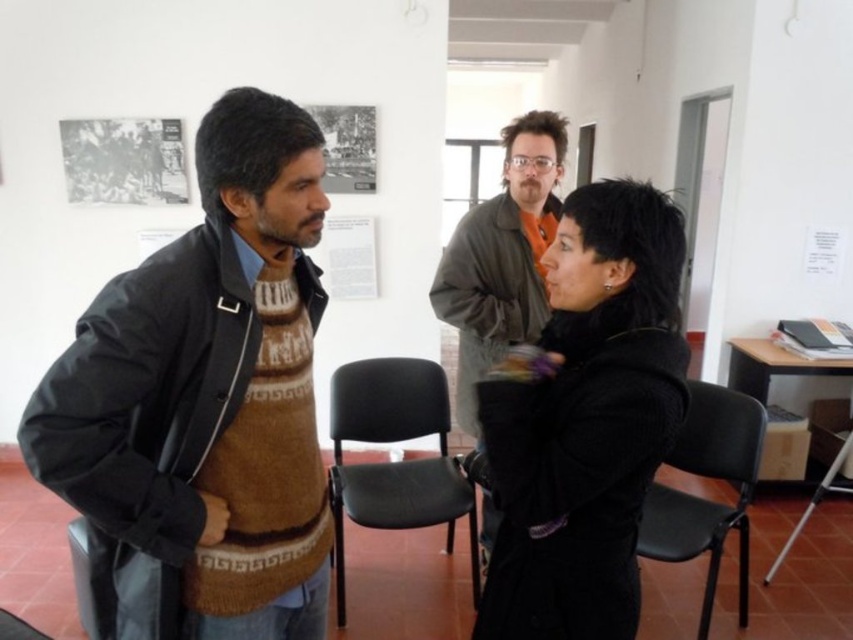
Question: Estimate the real-world distances between objects in this image. Which object is farther from the gray leather jacket at center?

Choices:
 (A) black plastic chair at center
 (B) black wool coat at center

Answer: (B)

Question: Is brown knitted sweater at center thinner than gray leather jacket at center?

Choices:
 (A) yes
 (B) no

Answer: (B)

Question: Estimate the real-world distances between objects in this image. Which object is closer to the gray leather jacket at center?

Choices:
 (A) brown knitted sweater at center
 (B) black plastic chair at center

Answer: (B)

Question: Among these objects, which one is farthest from the camera?

Choices:
 (A) brown knitted sweater at center
 (B) black plastic chair at center

Answer: (B)

Question: Is brown knitted sweater at center further to the viewer compared to black plastic chair at center?

Choices:
 (A) yes
 (B) no

Answer: (B)

Question: Is brown knitted sweater at center thinner than gray leather jacket at center?

Choices:
 (A) yes
 (B) no

Answer: (B)